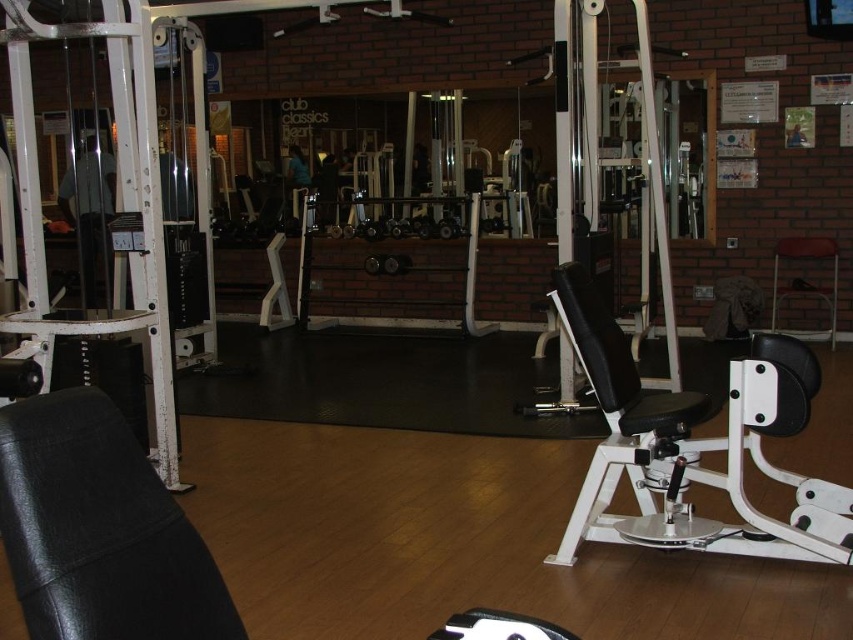
Is white plastic weight bench at right thinner than metallic stool at right?

In fact, white plastic weight bench at right might be wider than metallic stool at right.

Based on the photo, which of these two, white plastic weight bench at right or metallic stool at right, stands taller?

Standing taller between the two is white plastic weight bench at right.

In order to click on white plastic weight bench at right in this screenshot , I will do `click(694, 445)`.

Identify the location of white plastic weight bench at right. (694, 445).